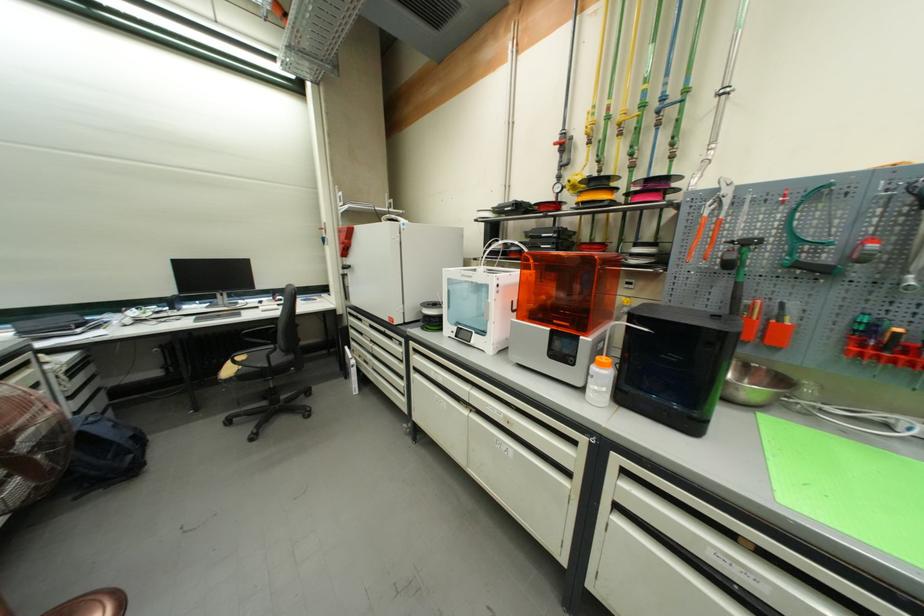
The location [755,384] corresponds to which object?

This point indicates the silver metal bowl.